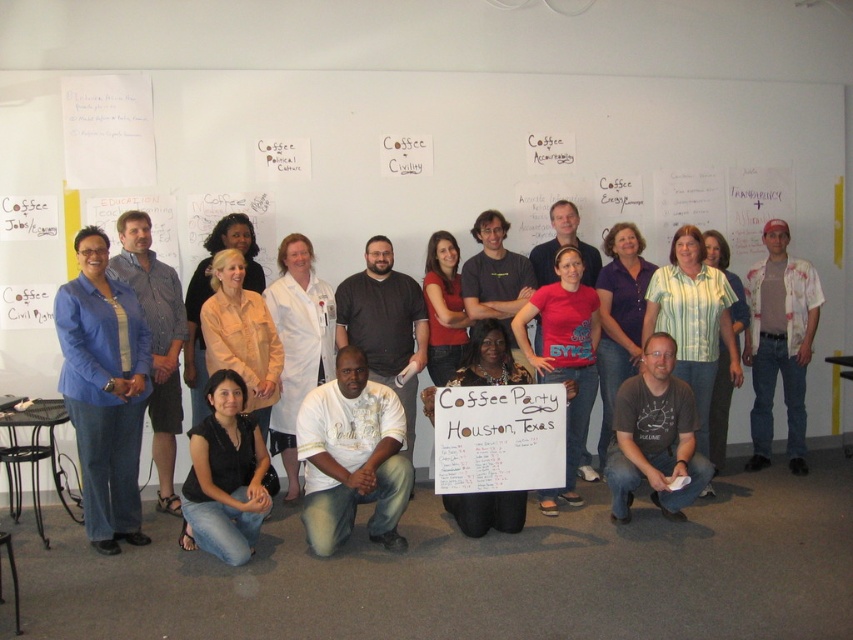
You are standing in the meeting room and want to find the blue fabric shirt at left. Where should you look relative to the whiteboard?

The blue fabric shirt at left is located at the lower left side of the whiteboard.

You are organizing a photo shoot and need to ensure that the white lab coat at center is visible in the final image. Given that the white painted shirt at right is currently blocking part of the lab coat, what adjustment should you make to the camera angle or subject positioning?

Move the white painted shirt at right to the side so that the white lab coat at center is no longer blocked.

You are standing in the meeting room and need to find the blue striped shirt at left. Which direction should you look relative to the black denim jeans at lower left?

The blue striped shirt at left is to the left of the black denim jeans at lower left. So, you should look to the left side of the black denim jeans at lower left to find the blue striped shirt at left.